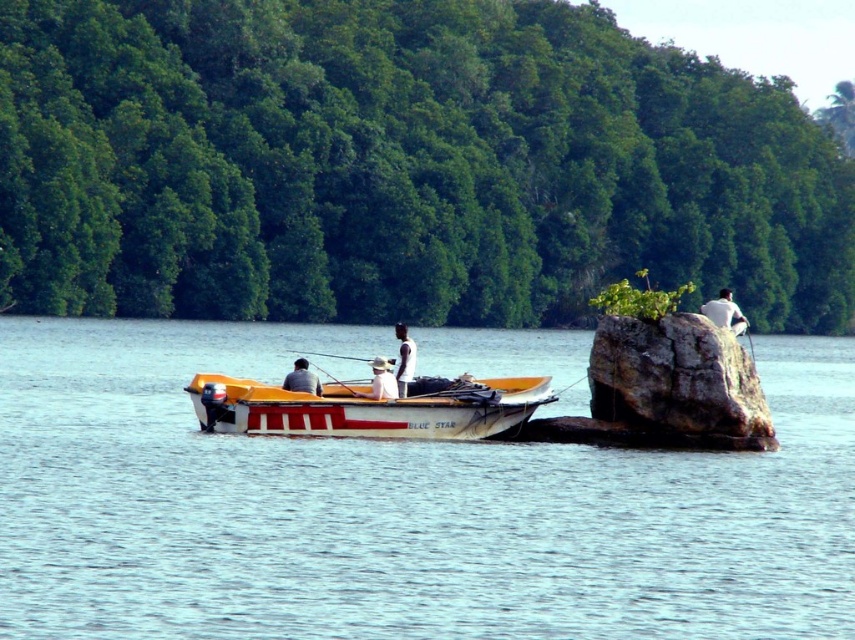
You are planning to take a photo of the blue water at center and the white matte shirt at upper right. Which object should you focus on first if you want to capture both in a single frame without moving the camera? Explain your reasoning based on their sizes.

The blue water at center should be focused on first because its width is larger than the white matte shirt at upper right. Since it occupies more space in the frame, prioritizing the larger object ensures it is properly centered and in focus, allowing the smaller white matte shirt at upper right to fit into the composition without needing to adjust the camera position.

You are standing at the edge of the lake and see two points in the water. The first point is at coordinates point (360, 436) and the second point is at point (314, 378). Which point is closer to your current position?

Point (360, 436) is closer to the camera than point (314, 378), so the first point is closer to your current position.

In the serene lakeside scene, you notice two individuals wearing different shirts. The first person is wearing a white matte shirt at upper right, and the second is wearing a light blue fabric shirt at center. Which shirt is bigger in size?

The white matte shirt at upper right is larger in size compared to the light blue fabric shirt at center.